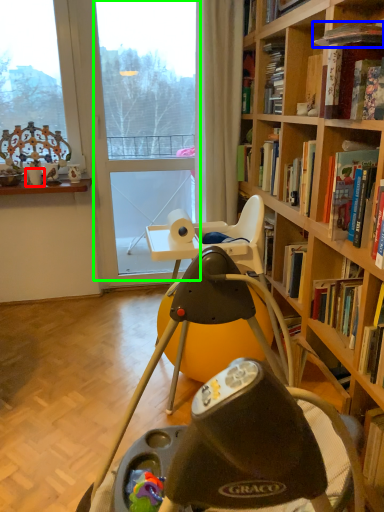
Question: Which object is positioned closest to coffee cup (highlighted by a red box)? Select from book (highlighted by a blue box) and glass door (highlighted by a green box).

Choices:
 (A) book
 (B) glass door

Answer: (B)